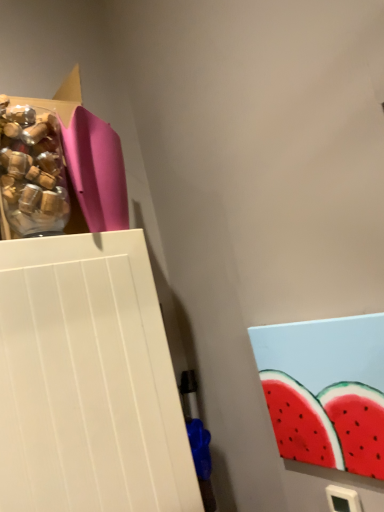
Question: Are pink matte paper at upper left and translucent plastic bottle at upper left beside each other?

Choices:
 (A) yes
 (B) no

Answer: (A)

Question: Is the position of pink matte paper at upper left less distant than that of translucent plastic bottle at upper left?

Choices:
 (A) yes
 (B) no

Answer: (B)

Question: Is pink matte paper at upper left positioned far away from translucent plastic bottle at upper left?

Choices:
 (A) yes
 (B) no

Answer: (B)

Question: From a real-world perspective, is pink matte paper at upper left below translucent plastic bottle at upper left?

Choices:
 (A) yes
 (B) no

Answer: (A)

Question: Considering the relative sizes of pink matte paper at upper left and translucent plastic bottle at upper left in the image provided, is pink matte paper at upper left thinner than translucent plastic bottle at upper left?

Choices:
 (A) yes
 (B) no

Answer: (B)

Question: Does pink matte paper at upper left have a greater height compared to translucent plastic bottle at upper left?

Choices:
 (A) no
 (B) yes

Answer: (B)

Question: Is there a large distance between translucent plastic bottle at upper left and pink matte paper at upper left?

Choices:
 (A) yes
 (B) no

Answer: (B)

Question: Does translucent plastic bottle at upper left have a greater width compared to pink matte paper at upper left?

Choices:
 (A) yes
 (B) no

Answer: (B)

Question: Considering the relative sizes of translucent plastic bottle at upper left and pink matte paper at upper left in the image provided, is translucent plastic bottle at upper left thinner than pink matte paper at upper left?

Choices:
 (A) yes
 (B) no

Answer: (A)

Question: From the image's perspective, is translucent plastic bottle at upper left located beneath pink matte paper at upper left?

Choices:
 (A) no
 (B) yes

Answer: (B)

Question: Is pink matte paper at upper left a part of translucent plastic bottle at upper left?

Choices:
 (A) yes
 (B) no

Answer: (B)

Question: From a real-world perspective, is translucent plastic bottle at upper left below pink matte paper at upper left?

Choices:
 (A) yes
 (B) no

Answer: (B)

Question: Is translucent plastic bottle at upper left wider or thinner than pink matte paper at upper left?

Choices:
 (A) wide
 (B) thin

Answer: (B)